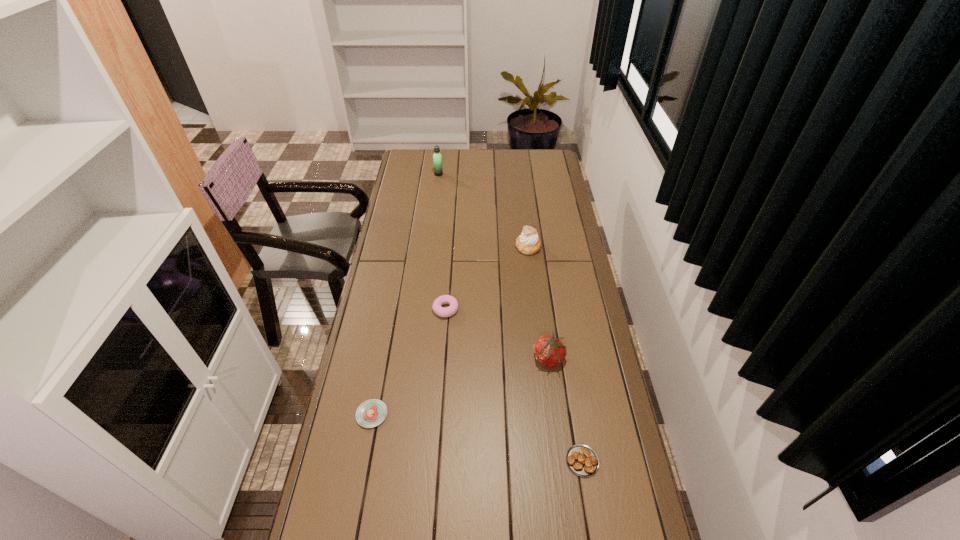
You are a GUI agent. You are given a task and a screenshot of the screen. Output one action in this format:
    pyautogui.click(x=<x>, y=<y>)
    Task: Click on the pastry present at the right edge
    
    Given the screenshot: What is the action you would take?
    pyautogui.click(x=582, y=460)

The width and height of the screenshot is (960, 540). In the image, there is a desktop. In order to click on vacant area at the far edge in this screenshot , I will do `click(502, 150)`.

Find the location of `vacant space at the left edge`. vacant space at the left edge is located at coordinates (402, 267).

Identify the location of vacant region at the right edge. (551, 230).

Locate an element on the screen. vacant space in between the fourth shortest object and the farthest pastry is located at coordinates (539, 303).

This screenshot has height=540, width=960. In order to click on vacant area that lies between the farthest pastry and the farthest object in this screenshot , I will do `click(483, 211)`.

Where is `vacant space in between the fourth shortest object and the fourth object from right to left`? This screenshot has width=960, height=540. vacant space in between the fourth shortest object and the fourth object from right to left is located at coordinates (497, 334).

Locate an element on the screen. This screenshot has width=960, height=540. empty location between the third tallest object and the nearest object is located at coordinates (565, 410).

At what (x,y) coordinates should I click in order to perform the action: click on unoccupied area between the third farthest object and the tomato. Please return your answer as a coordinate pair (x, y). Looking at the image, I should click on (497, 334).

Where is `vacant area between the farthest pastry and the second object from left to right`? This screenshot has height=540, width=960. vacant area between the farthest pastry and the second object from left to right is located at coordinates (483, 211).